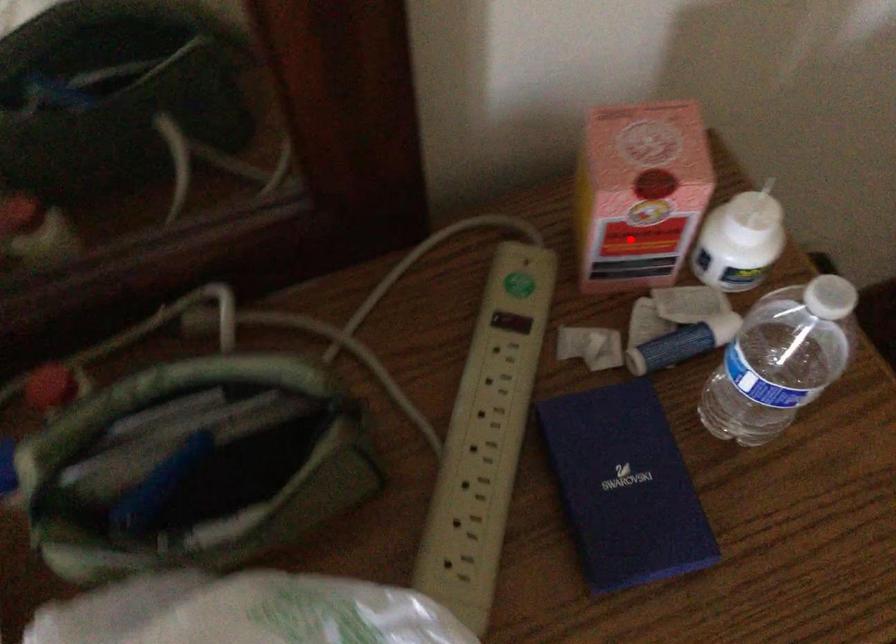
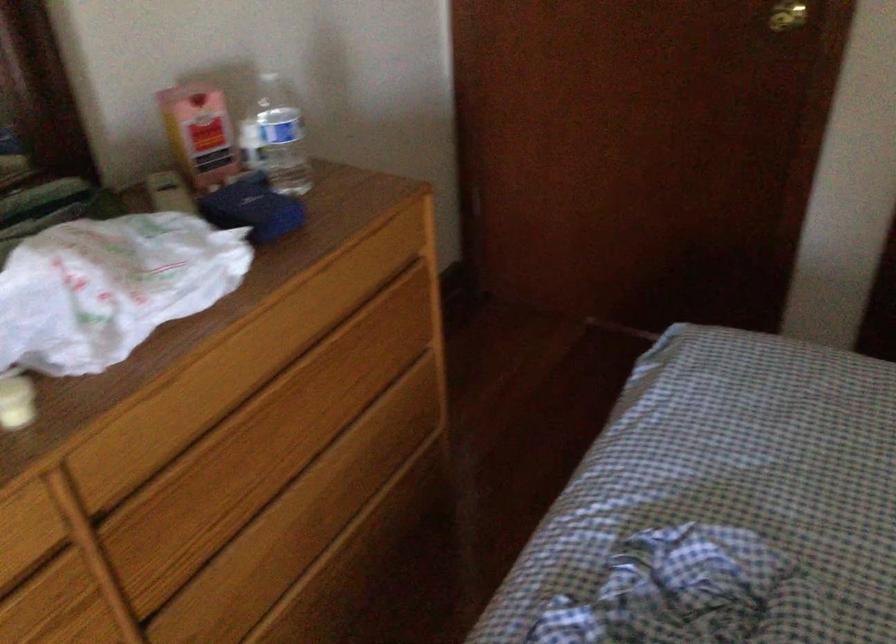
In the second image, find the point that corresponds to the highlighted location in the first image.

(200, 134)